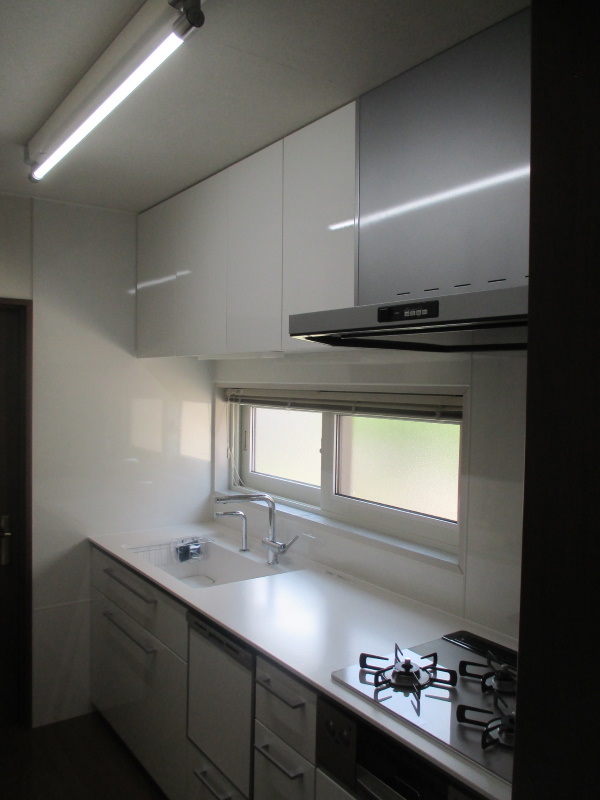
The width and height of the screenshot is (600, 800). Identify the location of stove burners. (406, 658), (502, 666), (508, 720).